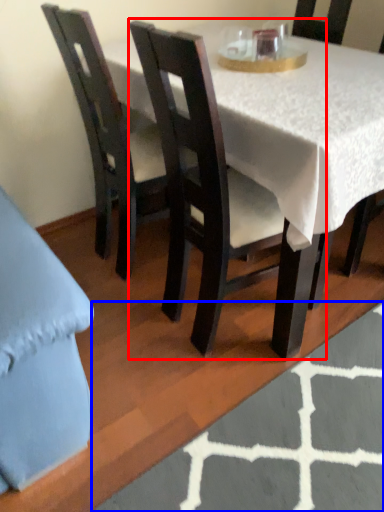
Question: Which point is further to the camera, chair (highlighted by a red box) or place mat (highlighted by a blue box)?

Choices:
 (A) chair
 (B) place mat

Answer: (B)